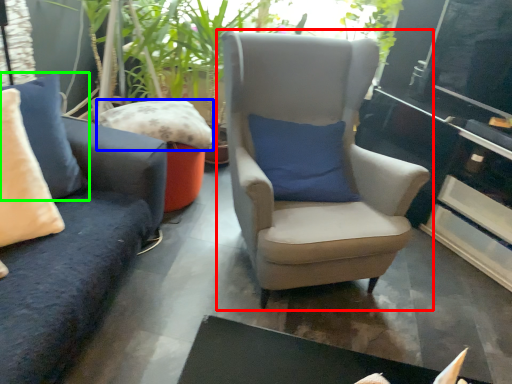
Question: Which object is the closest to the chair (highlighted by a red box)? Choose among these: pillow (highlighted by a blue box) or pillow (highlighted by a green box).

Choices:
 (A) pillow
 (B) pillow

Answer: (A)